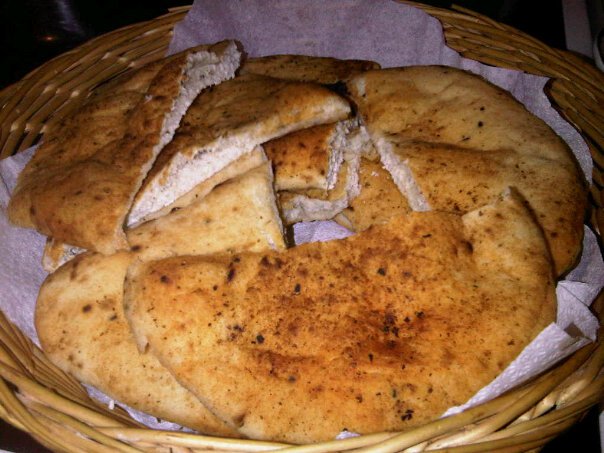
Find the location of a particular element. Image resolution: width=604 pixels, height=453 pixels. papertowe is located at coordinates (28, 252).